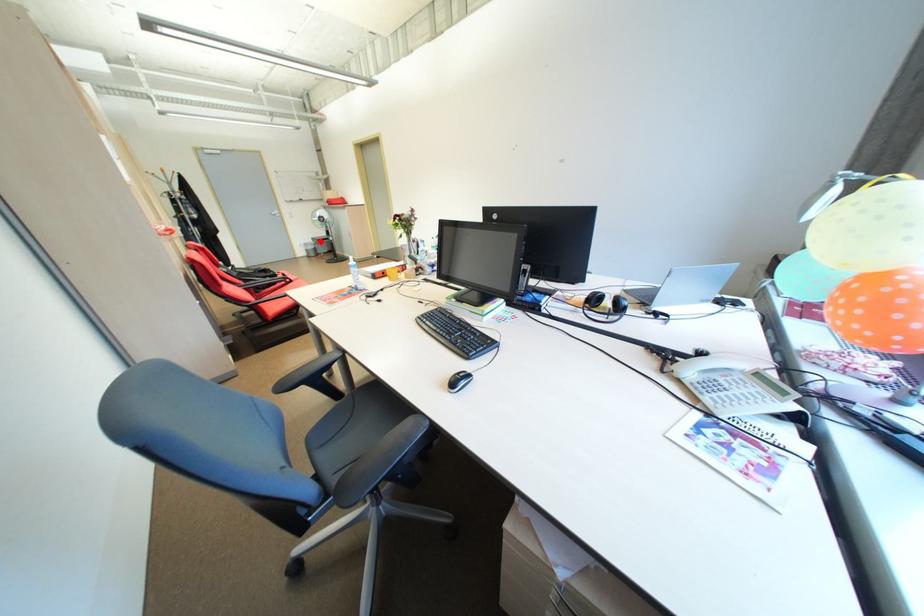
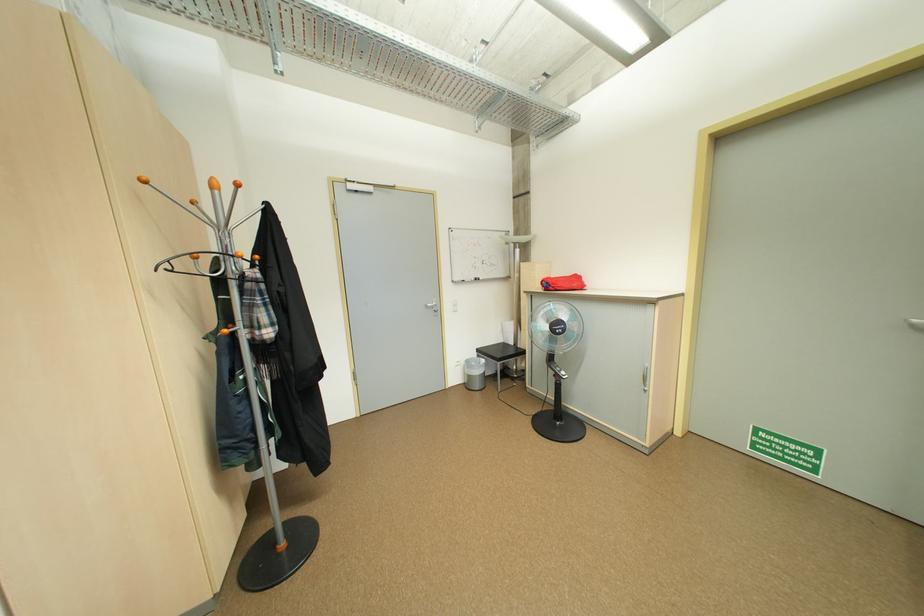
Question: I am providing you with two images of the same scene from different viewpoints. A red point is shown in image1. For the corresponding object point in image2, is it positioned nearer or farther from the camera?

Choices:
 (A) Nearer
 (B) Farther

Answer: (B)